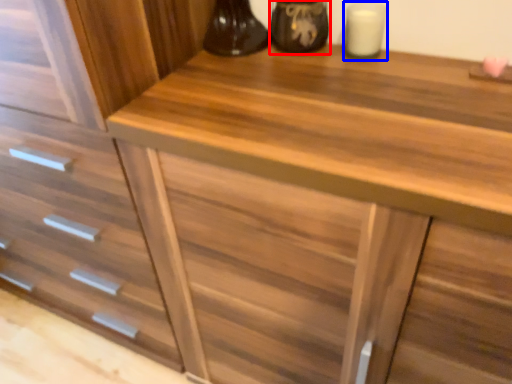
Question: Which object is closer to the camera taking this photo, appliance (highlighted by a red box) or candle holder (highlighted by a blue box)?

Choices:
 (A) appliance
 (B) candle holder

Answer: (B)